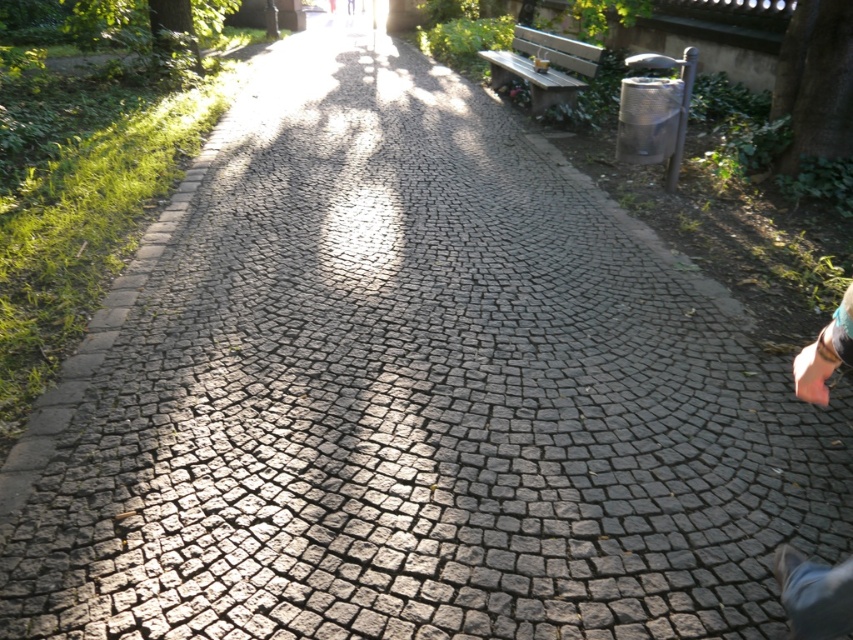
Question: Does light pink fabric at lower right have a lesser width compared to wooden bench at upper center?

Choices:
 (A) no
 (B) yes

Answer: (B)

Question: Among these objects, which one is farthest from the camera?

Choices:
 (A) wooden bench at upper center
 (B) light pink fabric at lower right

Answer: (A)

Question: Is light pink fabric at lower right closer to camera compared to wooden bench at upper center?

Choices:
 (A) yes
 (B) no

Answer: (A)

Question: Which of the following is the closest to the observer?

Choices:
 (A) light pink fabric at lower right
 (B) wooden bench at upper center

Answer: (A)

Question: Does light pink fabric at lower right have a smaller size compared to wooden bench at upper center?

Choices:
 (A) yes
 (B) no

Answer: (A)